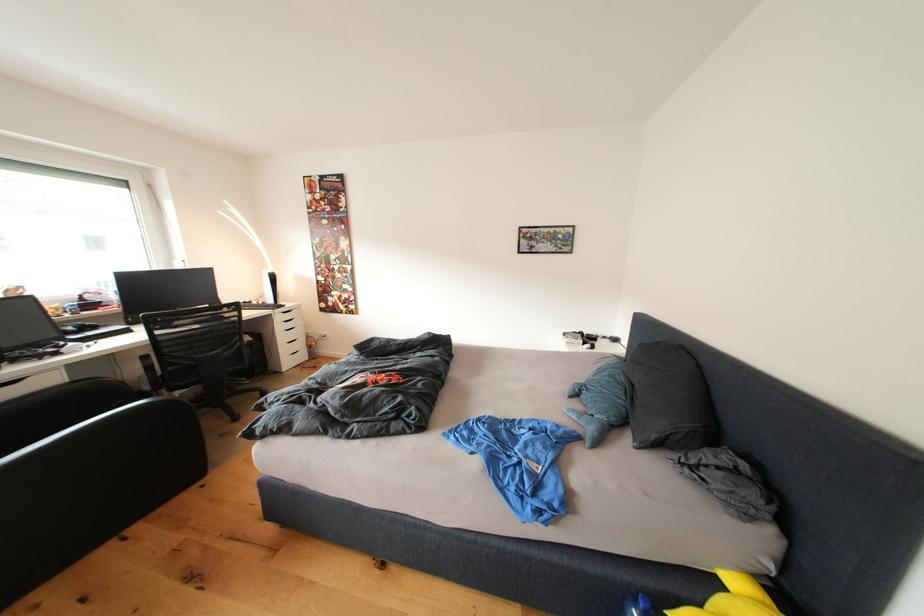
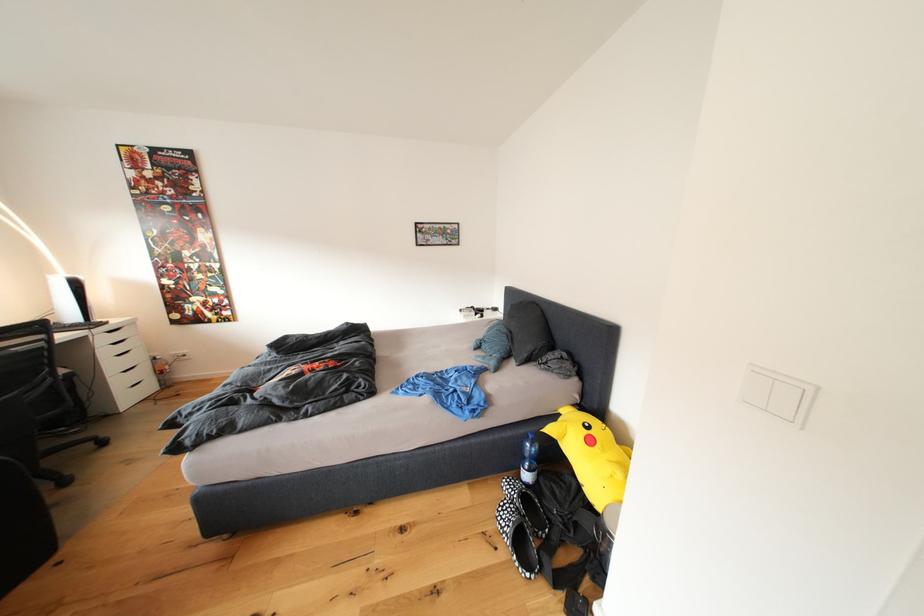
In the second image, find the point that corresponds to point (287, 323) in the first image.

(111, 344)